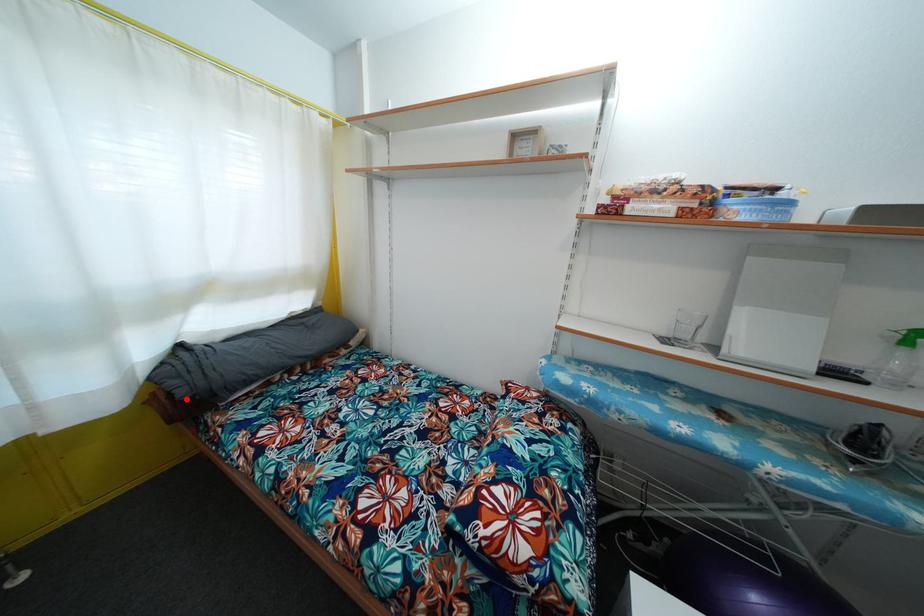
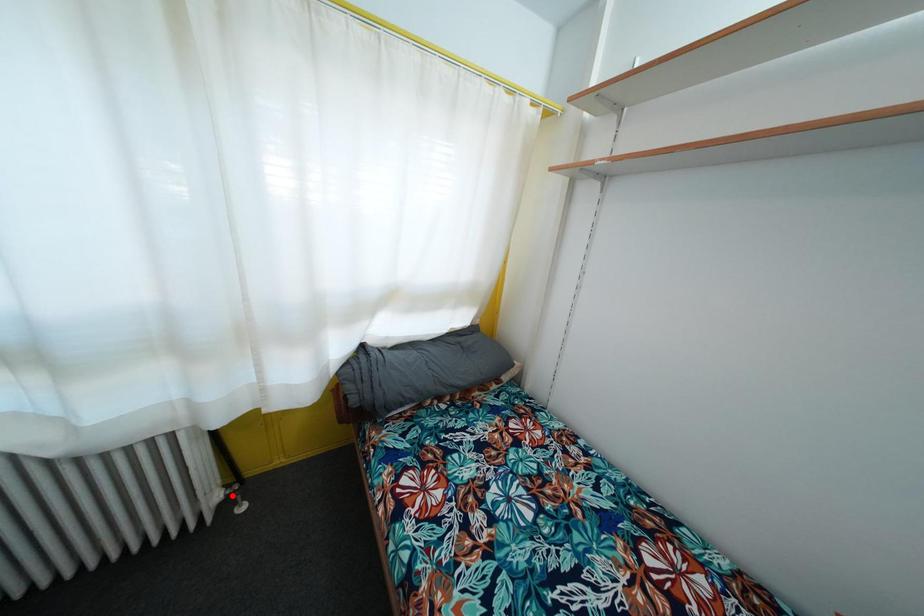
I am providing you with two images of the same scene from different viewpoints. A red point is marked on the first image and another point is marked on the second image. Is the marked point in image1 the same physical position as the marked point in image2?

No